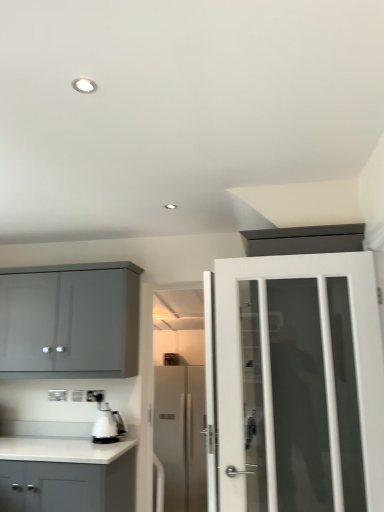
How much space does white matte cabinet at lower left, the second cabinetry when ordered from top to bottom, occupy vertically?

26.41 inches.

The height and width of the screenshot is (512, 384). What do you see at coordinates (66, 475) in the screenshot?
I see `white matte cabinet at lower left, which appears as the first cabinetry when ordered from the bottom` at bounding box center [66, 475].

What are the coordinates of `satin silver refrigerator at center, acting as the first door starting from the back` in the screenshot? It's located at (181, 435).

Identify the location of white glossy coffee machine at lower left. This screenshot has width=384, height=512. pyautogui.click(x=108, y=425).

Find the location of `white matte cabinet at lower left, the second cabinetry when ordered from top to bottom`. white matte cabinet at lower left, the second cabinetry when ordered from top to bottom is located at coordinates (66, 475).

Considering the relative sizes of white glass door at right, the second door when ordered from back to front, and white matte cabinet at lower left, which appears as the first cabinetry when ordered from the bottom, in the image provided, is white glass door at right, the second door when ordered from back to front, bigger than white matte cabinet at lower left, which appears as the first cabinetry when ordered from the bottom,?

Actually, white glass door at right, the second door when ordered from back to front, might be smaller than white matte cabinet at lower left, which appears as the first cabinetry when ordered from the bottom.

Can you confirm if white glass door at right, the 2th door when ordered from bottom to top, is wider than white matte cabinet at lower left, which appears as the first cabinetry when ordered from the bottom?

In fact, white glass door at right, the 2th door when ordered from bottom to top, might be narrower than white matte cabinet at lower left, which appears as the first cabinetry when ordered from the bottom.

Looking at this image, which of these two, white glass door at right, acting as the 1th door starting from the front, or white matte cabinet at lower left, which appears as the first cabinetry when ordered from the bottom, stands shorter?

With less height is white matte cabinet at lower left, which appears as the first cabinetry when ordered from the bottom.

Is white glass door at right, which is the 1th door in top-to-bottom order, surrounding satin silver refrigerator at center, acting as the second door starting from the front?

That's incorrect, satin silver refrigerator at center, acting as the second door starting from the front, is not inside white glass door at right, which is the 1th door in top-to-bottom order.

Is white glass door at right, the second door when ordered from back to front, next to satin silver refrigerator at center, acting as the second door starting from the front?

white glass door at right, the second door when ordered from back to front, is not next to satin silver refrigerator at center, acting as the second door starting from the front, and they're not touching.

Is point (291, 301) behind point (164, 465)?

No, (291, 301) is closer to viewer.

Can you confirm if white glass door at right, the second door when ordered from back to front, is taller than satin silver refrigerator at center, acting as the first door starting from the back?

No.

Is satin silver refrigerator at center, marked as the second door in a top-to-bottom arrangement, smaller than white matte cabinet at lower left, the second cabinetry when ordered from top to bottom?

Actually, satin silver refrigerator at center, marked as the second door in a top-to-bottom arrangement, might be larger than white matte cabinet at lower left, the second cabinetry when ordered from top to bottom.

Which is in front, satin silver refrigerator at center, acting as the second door starting from the front, or white matte cabinet at lower left, which appears as the first cabinetry when ordered from the bottom?

white matte cabinet at lower left, which appears as the first cabinetry when ordered from the bottom, is more forward.

From the image's perspective, is satin silver refrigerator at center, which is the 1th door from bottom to top, located beneath white matte cabinet at lower left, which appears as the first cabinetry when ordered from the bottom?

Yes, from the image's perspective, satin silver refrigerator at center, which is the 1th door from bottom to top, is below white matte cabinet at lower left, which appears as the first cabinetry when ordered from the bottom.

Is satin silver refrigerator at center, acting as the first door starting from the back, looking in the opposite direction of white matte cabinet at lower left, the second cabinetry when ordered from top to bottom?

No, white matte cabinet at lower left, the second cabinetry when ordered from top to bottom, is not at the back of satin silver refrigerator at center, acting as the first door starting from the back.

What's the angular difference between white glossy coffee machine at lower left and white plastic electric outlet at lower center's facing directions?

white glossy coffee machine at lower left and white plastic electric outlet at lower center are facing 0.0161 degrees away from each other.

From the image's perspective, is white glossy coffee machine at lower left above or below white plastic electric outlet at lower center?

Based on their image positions, white glossy coffee machine at lower left is located beneath white plastic electric outlet at lower center.

Which of these two, white glossy coffee machine at lower left or white plastic electric outlet at lower center, stands shorter?

Standing shorter between the two is white plastic electric outlet at lower center.

Consider the image. Are white glossy coffee machine at lower left and white plastic electric outlet at lower center located far from each other?

A: They are positioned close to each other.

Between point (27, 274) and point (164, 392), which one is positioned in front?

Point (27, 274)

Which object is further away from the camera taking this photo, matte gray cabinet at upper left, the 1th cabinetry positioned from the top, or satin silver refrigerator at center, marked as the second door in a top-to-bottom arrangement?

satin silver refrigerator at center, marked as the second door in a top-to-bottom arrangement, is more distant.

From a real-world perspective, starting from the satin silver refrigerator at center, which is the 1th door from bottom to top, which cabinetry is the 2nd one vertically above it? Please provide its 2D coordinates.

[(70, 321)]

Is matte gray cabinet at upper left, the 1th cabinetry positioned from the top, positioned with its back to satin silver refrigerator at center, marked as the second door in a top-to-bottom arrangement?

No, satin silver refrigerator at center, marked as the second door in a top-to-bottom arrangement, is not at the back of matte gray cabinet at upper left, the 1th cabinetry positioned from the top.

The image size is (384, 512). I want to click on door located above the white glossy coffee machine at lower left (from the image's perspective), so click(299, 383).

Which is less distant, (116, 431) or (283, 483)?

Point (116, 431).

Who is taller, white glossy coffee machine at lower left or white glass door at right, which is the 1th door in top-to-bottom order?

Standing taller between the two is white glass door at right, which is the 1th door in top-to-bottom order.

In the scene shown: Considering the relative sizes of white glossy coffee machine at lower left and white glass door at right, acting as the 1th door starting from the front, in the image provided, is white glossy coffee machine at lower left bigger than white glass door at right, acting as the 1th door starting from the front,?

No.

Consider the image. From a real-world perspective, does white matte cabinet at lower left, the second cabinetry when ordered from top to bottom, stand above satin silver refrigerator at center, acting as the first door starting from the back?

Yes, from a real-world perspective, white matte cabinet at lower left, the second cabinetry when ordered from top to bottom, is over satin silver refrigerator at center, acting as the first door starting from the back

Is white matte cabinet at lower left, the second cabinetry when ordered from top to bottom, not close to satin silver refrigerator at center, marked as the second door in a top-to-bottom arrangement?

That's right, there is a large distance between white matte cabinet at lower left, the second cabinetry when ordered from top to bottom, and satin silver refrigerator at center, marked as the second door in a top-to-bottom arrangement.

Can you confirm if white matte cabinet at lower left, which appears as the first cabinetry when ordered from the bottom, is wider than satin silver refrigerator at center, marked as the second door in a top-to-bottom arrangement?

No, white matte cabinet at lower left, which appears as the first cabinetry when ordered from the bottom, is not wider than satin silver refrigerator at center, marked as the second door in a top-to-bottom arrangement.

Is satin silver refrigerator at center, which is the 1th door from bottom to top, at the back of white matte cabinet at lower left, the second cabinetry when ordered from top to bottom?

That's right, white matte cabinet at lower left, the second cabinetry when ordered from top to bottom, is facing away from satin silver refrigerator at center, which is the 1th door from bottom to top.

Identify the location of door that is the 2nd object to the right of the white matte cabinet at lower left, the second cabinetry when ordered from top to bottom, starting at the anchor. The image size is (384, 512). (299, 383).

The height and width of the screenshot is (512, 384). Find the location of `door beneath the white glass door at right, which is the 1th door in top-to-bottom order (from a real-world perspective)`. door beneath the white glass door at right, which is the 1th door in top-to-bottom order (from a real-world perspective) is located at coordinates (181, 435).

When comparing their distances from white glass door at right, the second door when ordered from back to front, does satin silver refrigerator at center, marked as the second door in a top-to-bottom arrangement, or matte gray cabinet at upper left, the 1th cabinetry positioned from the top, seem closer?

matte gray cabinet at upper left, the 1th cabinetry positioned from the top, is positioned closer to the anchor white glass door at right, the second door when ordered from back to front.

Considering their positions, is white glass door at right, acting as the 1th door starting from the front, positioned further to white glossy coffee machine at lower left than satin silver refrigerator at center, acting as the second door starting from the front?

Based on the image, satin silver refrigerator at center, acting as the second door starting from the front, appears to be further to white glossy coffee machine at lower left.

Looking at the image, which one is located further to white matte cabinet at lower left, the second cabinetry when ordered from top to bottom, matte gray cabinet at upper left, the 1th cabinetry positioned from the top, or white glossy coffee machine at lower left?

Based on the image, matte gray cabinet at upper left, the 1th cabinetry positioned from the top, appears to be further to white matte cabinet at lower left, the second cabinetry when ordered from top to bottom.

From the image, which object appears to be farther from matte gray cabinet at upper left, acting as the second cabinetry starting from the bottom, white glass door at right, the 2th door when ordered from bottom to top, or white plastic electric outlet at lower center?

Among the two, white glass door at right, the 2th door when ordered from bottom to top, is located further to matte gray cabinet at upper left, acting as the second cabinetry starting from the bottom.

In the scene shown: Which object lies nearer to the anchor point matte gray cabinet at upper left, the 1th cabinetry positioned from the top, satin silver refrigerator at center, acting as the first door starting from the back, or white matte cabinet at lower left, the second cabinetry when ordered from top to bottom?

white matte cabinet at lower left, the second cabinetry when ordered from top to bottom.

From the image, which object appears to be nearer to white matte cabinet at lower left, which appears as the first cabinetry when ordered from the bottom, white plastic electric outlet at lower center or satin silver refrigerator at center, acting as the first door starting from the back?

white plastic electric outlet at lower center is closer to white matte cabinet at lower left, which appears as the first cabinetry when ordered from the bottom.

From the image, which object appears to be nearer to white glossy coffee machine at lower left, white matte cabinet at lower left, the second cabinetry when ordered from top to bottom, or matte gray cabinet at upper left, acting as the second cabinetry starting from the bottom?

The object closer to white glossy coffee machine at lower left is white matte cabinet at lower left, the second cabinetry when ordered from top to bottom.

Considering their positions, is satin silver refrigerator at center, acting as the second door starting from the front, positioned further to white plastic electric outlet at lower center than white glass door at right, acting as the 1th door starting from the front?

satin silver refrigerator at center, acting as the second door starting from the front, is positioned further to the anchor white plastic electric outlet at lower center.

Where is `cabinetry situated between matte gray cabinet at upper left, acting as the second cabinetry starting from the bottom, and white glass door at right, which is the 1th door in top-to-bottom order, from left to right`? cabinetry situated between matte gray cabinet at upper left, acting as the second cabinetry starting from the bottom, and white glass door at right, which is the 1th door in top-to-bottom order, from left to right is located at coordinates (66, 475).

Where is `cabinetry between white matte cabinet at lower left, the second cabinetry when ordered from top to bottom, and satin silver refrigerator at center, marked as the second door in a top-to-bottom arrangement, from front to back`? This screenshot has height=512, width=384. cabinetry between white matte cabinet at lower left, the second cabinetry when ordered from top to bottom, and satin silver refrigerator at center, marked as the second door in a top-to-bottom arrangement, from front to back is located at coordinates (70, 321).

Find the location of a particular element. The image size is (384, 512). coffee machine between white glass door at right, acting as the 1th door starting from the front, and white plastic electric outlet at lower center, along the z-axis is located at coordinates (108, 425).

The image size is (384, 512). Identify the location of coffee machine located between white matte cabinet at lower left, the second cabinetry when ordered from top to bottom, and white glass door at right, which is the 1th door in top-to-bottom order, in the left-right direction. (108, 425).